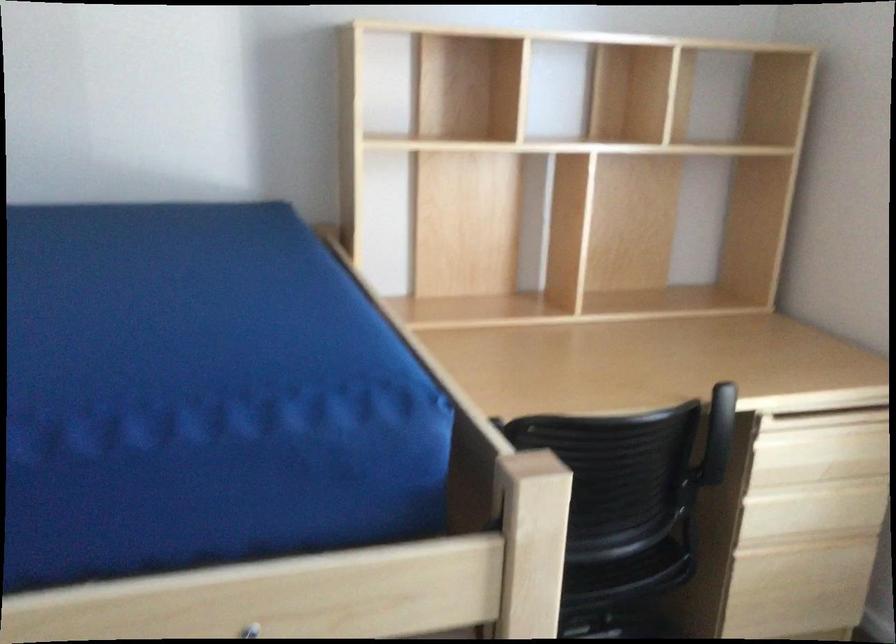
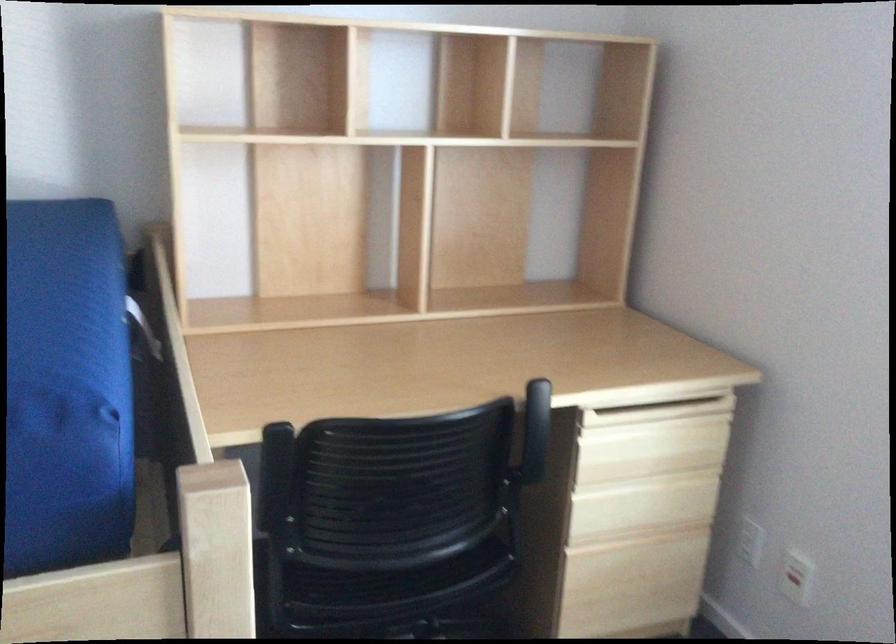
Question: The first image is from the beginning of the video and the second image is from the end. How did the camera likely rotate when shooting the video?

Choices:
 (A) Left
 (B) Right
 (C) Up
 (D) Down

Answer: (B)